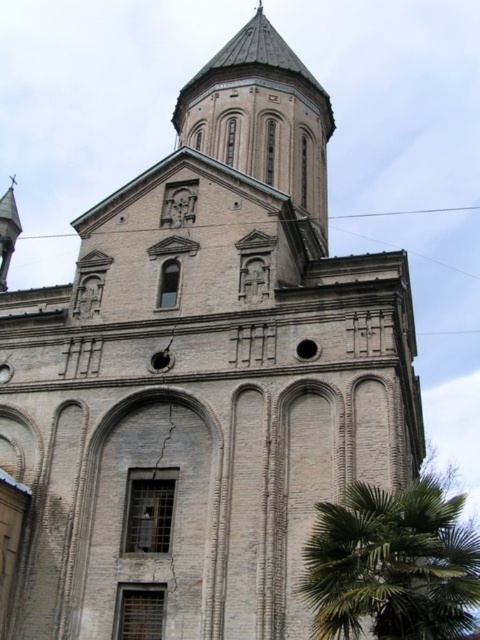
Who is more distant from viewer, [410,618] or [219,138]?

Point [219,138]

Is green leafy palm at lower right taller than brown stone bell tower at upper center?

No.

Is point (343, 595) farther from viewer compared to point (264, 112)?

No, it is not.

Where is `green leafy palm at lower right`? Image resolution: width=480 pixels, height=640 pixels. green leafy palm at lower right is located at coordinates (392, 563).